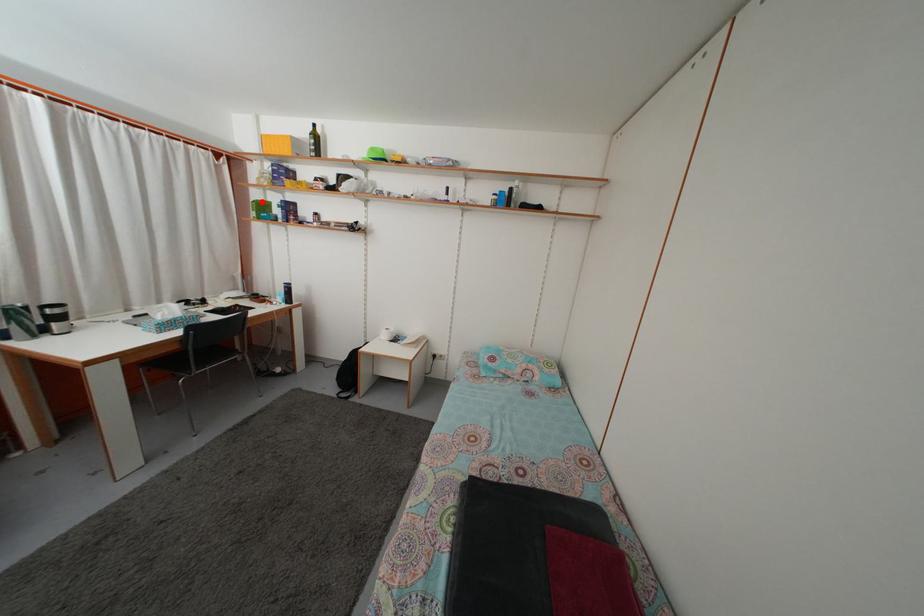
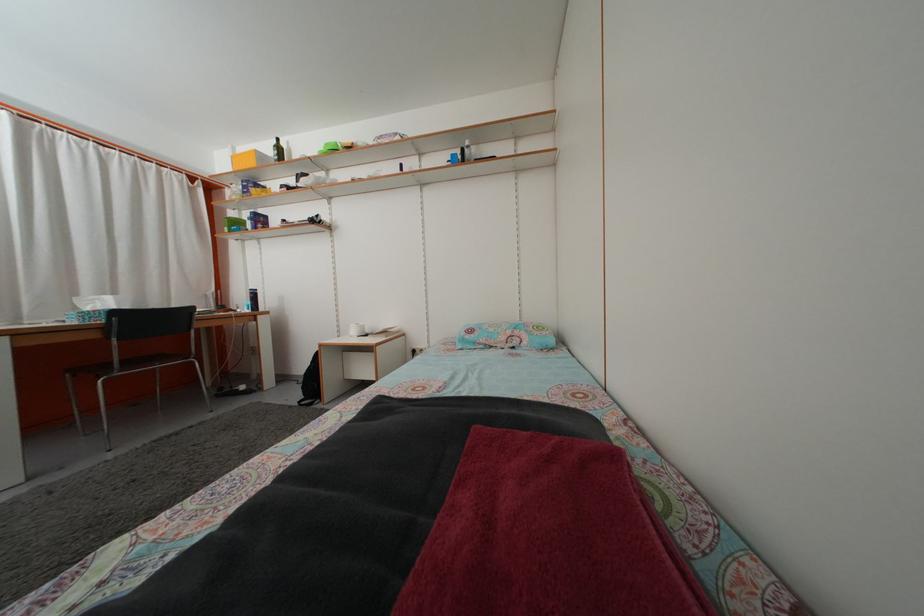
The point at the highlighted location is marked in the first image. Where is the corresponding point in the second image?

(237, 223)